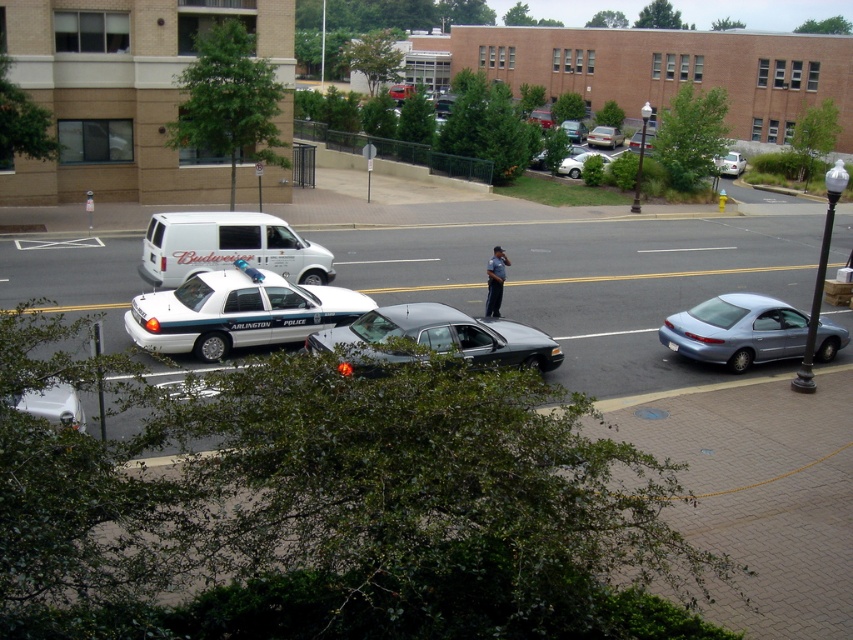
You are a delivery driver who needs to turn around your vehicle. You see a silver metallic car at lower left and a metallic silver sedan at center. Which vehicle has more space between its sides and the road edge to safely maneuver?

The metallic silver sedan at center is wider than the silver metallic car at lower left, so it requires more space to maneuver. Therefore, the silver metallic car at lower left has more space between its sides and the road edge for safe maneuvering.

You are a pedestrian standing on the sidewalk observing the scene. You see a metallic silver car at center and a shiny black sedan at center. Which vehicle is closer to you?

The metallic silver car at center is closer to you because the shiny black sedan at center is behind it.

You are a delivery driver who needs to park your 2.5 meters wide truck between the metallic silver car at center and the shiny black sedan at center on the street. Can your truck fit in the space between them?

The metallic silver car at center is wider than the shiny black sedan at center. However, without knowing the exact distance between them, it is impossible to determine if the 2.5 meters wide truck can fit. Please check the available space between the two vehicles first.